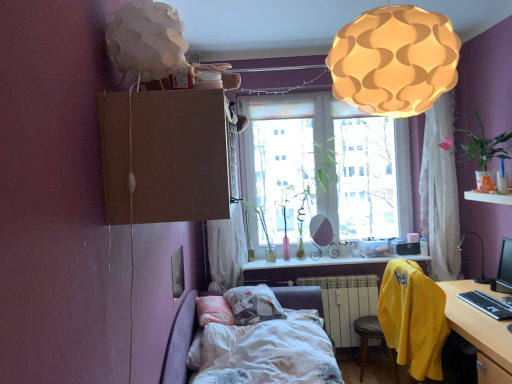
Identify the location of free spot behind black plastic keyboard at lower right. (474, 287).